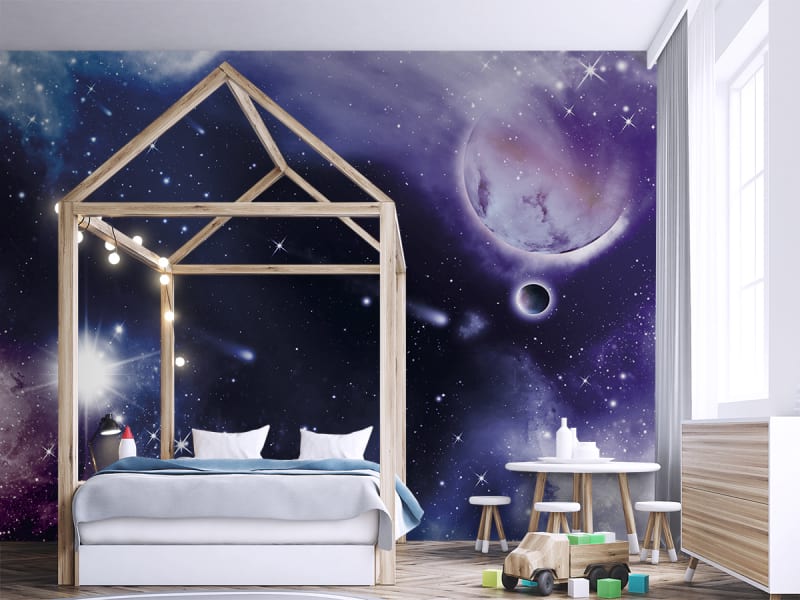
Identify the location of white pillows. This screenshot has height=600, width=800. (354, 442), (216, 438).